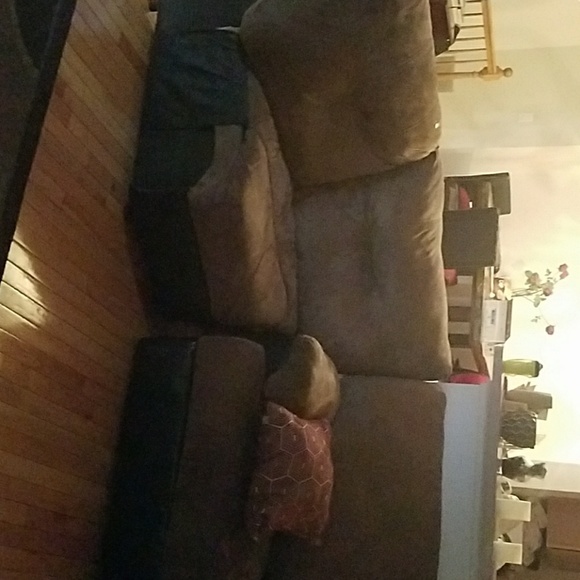
You are a GUI agent. You are given a task and a screenshot of the screen. Output one action in this format:
    pyautogui.click(x=<x>, y=<y>)
    Task: Click on the couch
    
    Given the screenshot: What is the action you would take?
    pyautogui.click(x=172, y=430), pyautogui.click(x=182, y=134)